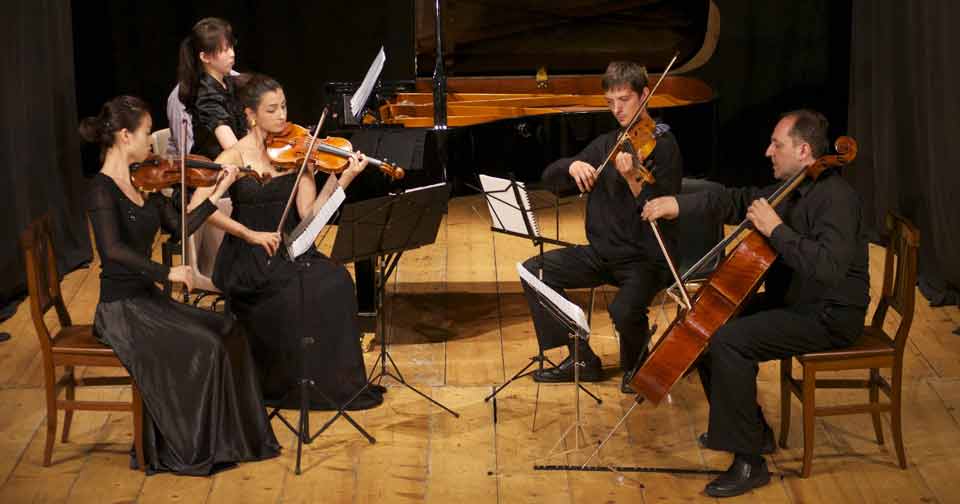
Locate an element on the screen. The width and height of the screenshot is (960, 504). music sheet is located at coordinates (317, 230), (411, 230), (366, 77), (506, 206), (564, 302).